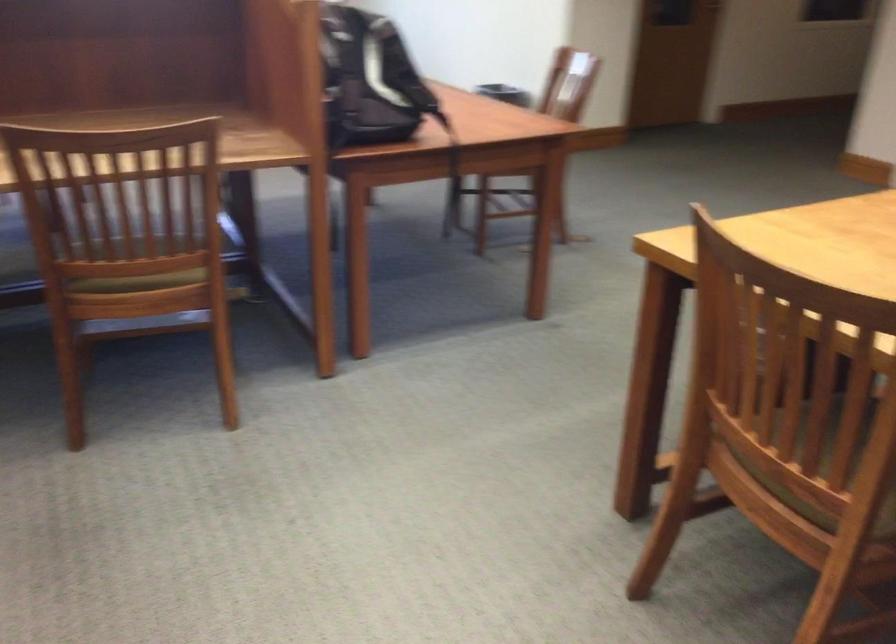
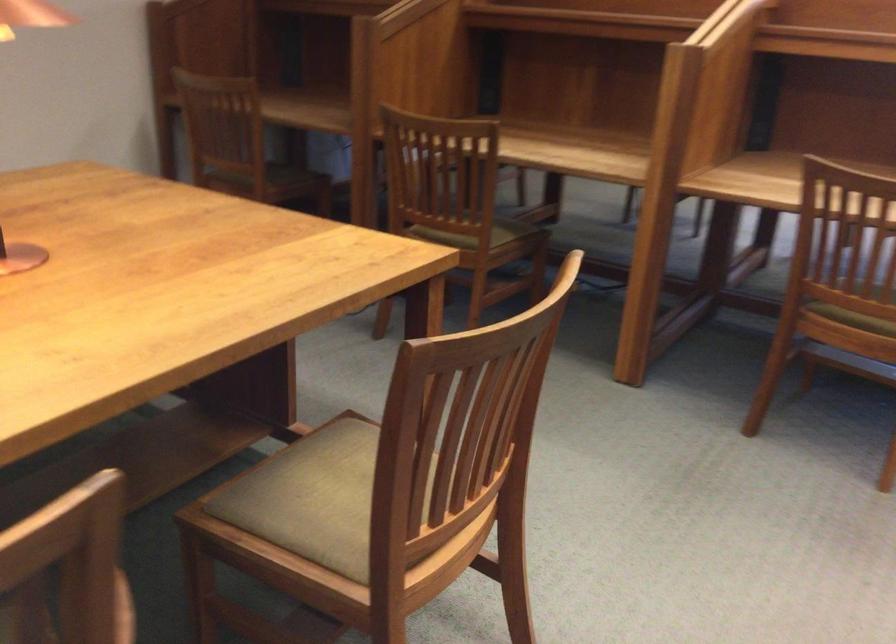
Question: How did the camera likely rotate?

Choices:
 (A) Left
 (B) Right
 (C) Up
 (D) Down

Answer: (A)